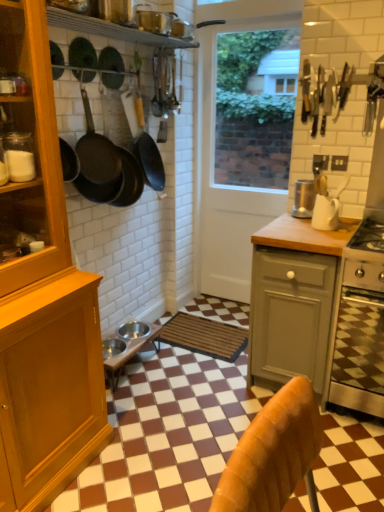
The height and width of the screenshot is (512, 384). Find the location of `blank space situated above white glossy door at center (from a real-world perspective)`. blank space situated above white glossy door at center (from a real-world perspective) is located at coordinates (264, 14).